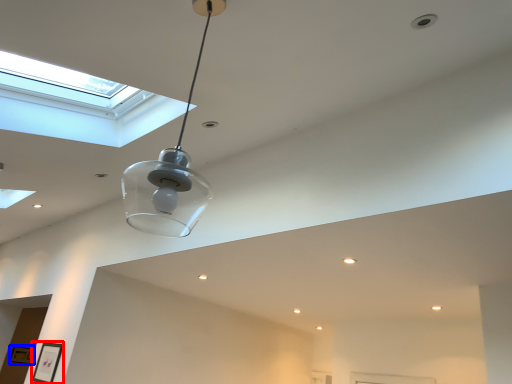
Question: Which point is further to the camera, picture frame (highlighted by a red box) or picture frame (highlighted by a blue box)?

Choices:
 (A) picture frame
 (B) picture frame

Answer: (B)